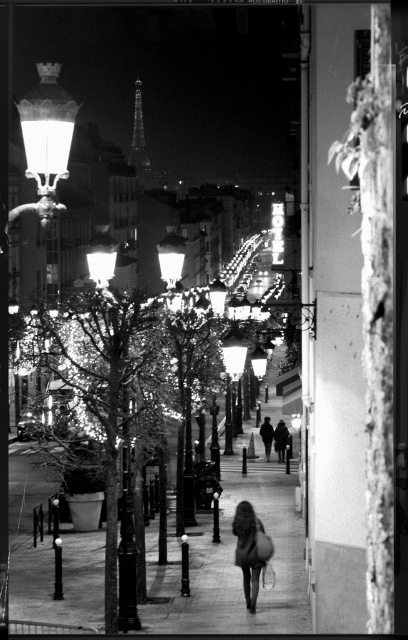
Question: Among these points, which one is nearest to the camera?

Choices:
 (A) (102, 627)
 (B) (62, 177)

Answer: (B)

Question: Which object is positioned closest to the shiny metal streetlamp at upper left?

Choices:
 (A) dark fabric bag at center
 (B) shiny metallic eiffel tower at upper center
 (C) smooth concrete sidewalk at center

Answer: (A)

Question: Can you confirm if shiny metal streetlamp at upper left is positioned below shiny metallic eiffel tower at upper center?

Choices:
 (A) yes
 (B) no

Answer: (A)

Question: Can you confirm if shiny metal streetlamp at upper left is positioned to the left of shiny metallic eiffel tower at upper center?

Choices:
 (A) no
 (B) yes

Answer: (A)

Question: Based on their relative distances, which object is farther from the smooth concrete sidewalk at center?

Choices:
 (A) shiny metal streetlamp at upper left
 (B) dark fabric bag at center

Answer: (A)

Question: From the image, what is the correct spatial relationship of smooth concrete sidewalk at center in relation to dark fabric bag at center?

Choices:
 (A) above
 (B) below

Answer: (B)